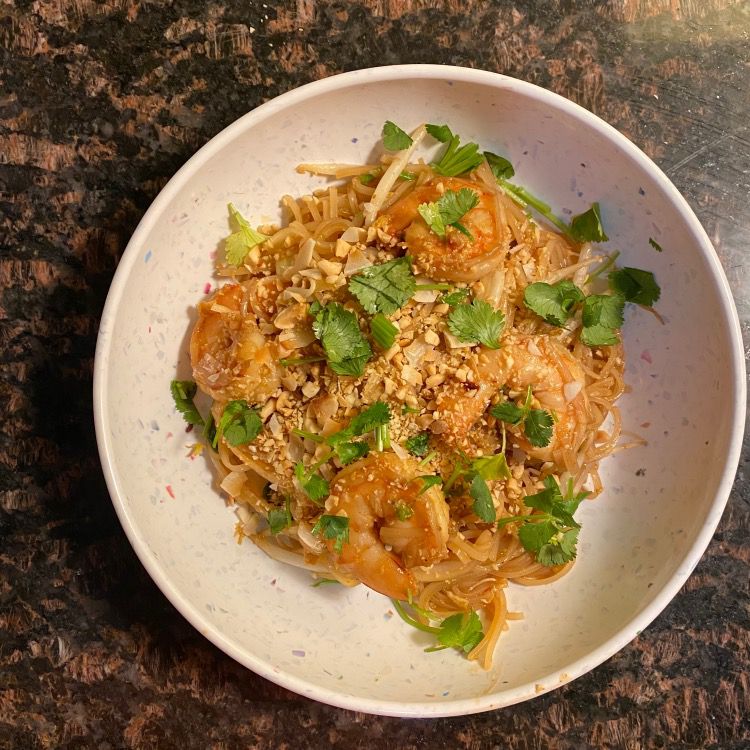
I want to click on white bowl inside sides, so click(x=334, y=138), click(x=546, y=604), click(x=309, y=602), click(x=166, y=534), click(x=166, y=256).